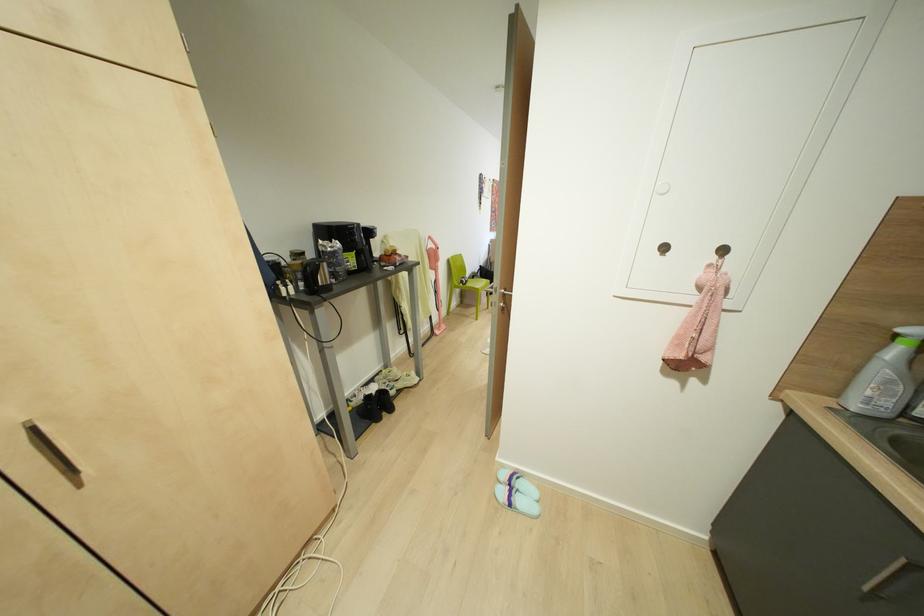
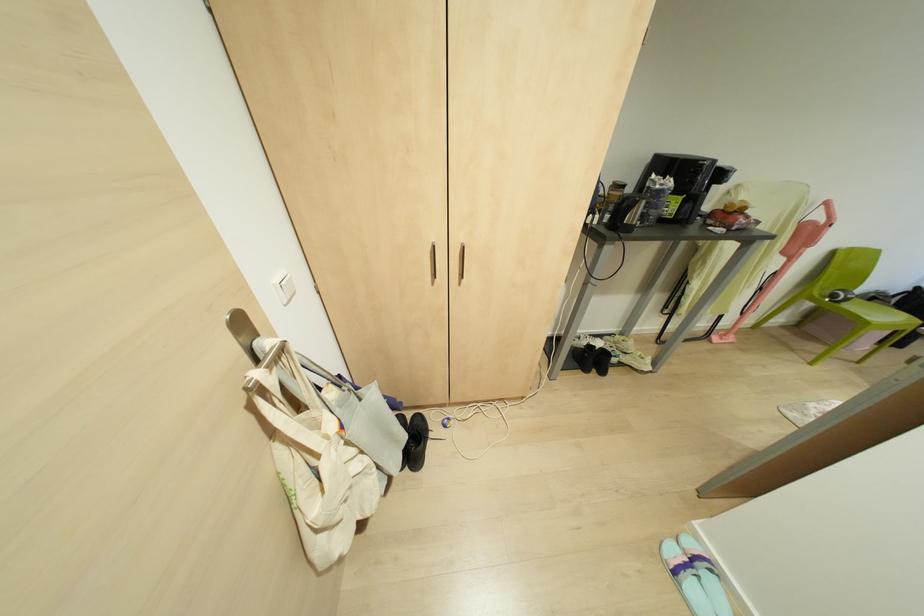
The point at (460, 282) is marked in the first image. Where is the corresponding point in the second image?

(833, 294)